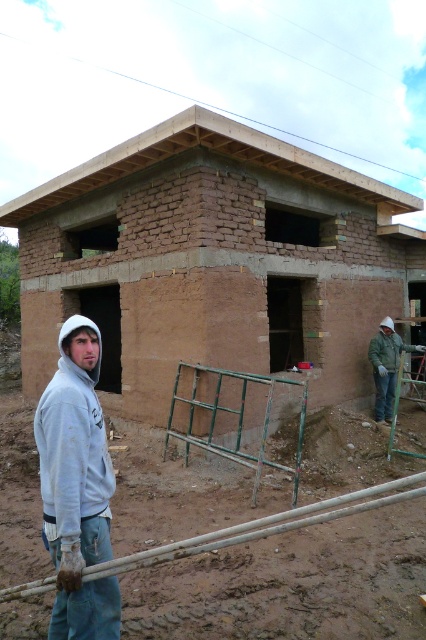
You are a safety inspector visiting the construction site. You see the gray hoodie at left and the white matte construction worker at right. Which worker is nearer to you?

The gray hoodie at left is closer to the viewer than the white matte construction worker at right, so the gray hoodie at left is nearer to you.

Looking at this image, you are a construction inspector standing at the right side of the image. You need to check the structural integrity of the brown mud hut at center and the gray hoodie at left. Which object is closer to your current position?

The gray hoodie at left is closer to your current position because the brown mud hut at center is positioned on the left side of the gray hoodie at left, meaning the gray hoodie is between you and the mud hut.